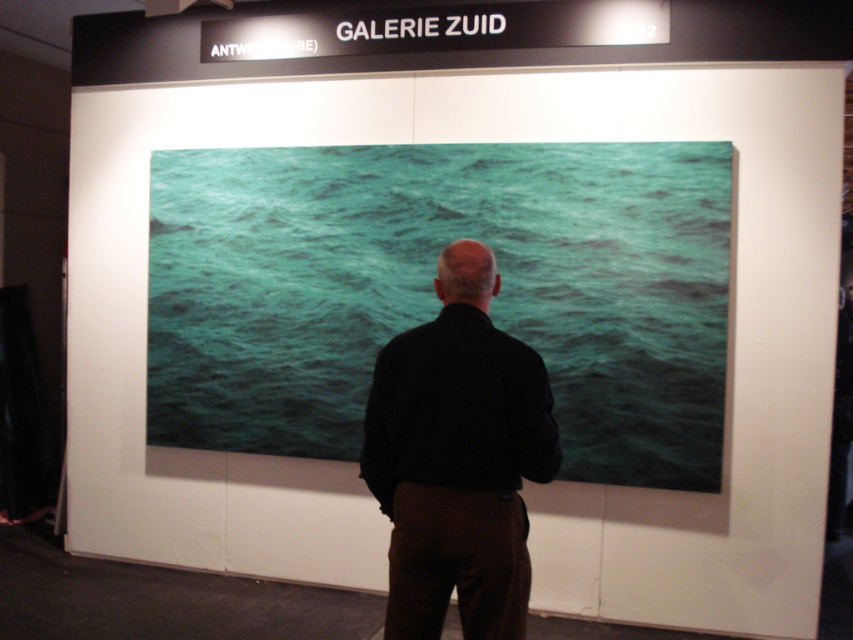
Question: Which object appears closest to the camera in this image?

Choices:
 (A) black matte shirt at center
 (B) teal glossy water at center

Answer: (A)

Question: Is the position of teal glossy water at center more distant than that of black matte shirt at center?

Choices:
 (A) yes
 (B) no

Answer: (A)

Question: From the image, what is the correct spatial relationship of teal glossy water at center in relation to black matte shirt at center?

Choices:
 (A) right
 (B) left

Answer: (B)

Question: Is the position of teal glossy water at center less distant than that of black matte shirt at center?

Choices:
 (A) yes
 (B) no

Answer: (B)